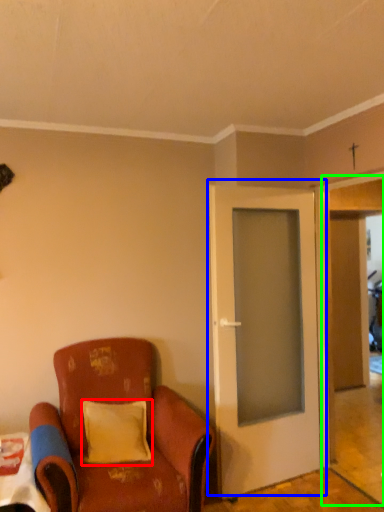
Question: Based on their relative distances, which object is nearer to pillow (highlighted by a red box)? Choose from door (highlighted by a blue box) and garage door (highlighted by a green box).

Choices:
 (A) door
 (B) garage door

Answer: (A)